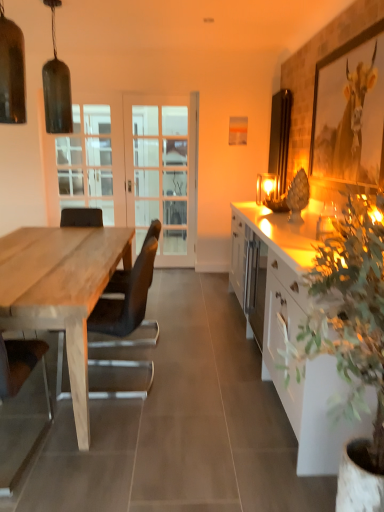
Question: From the image's perspective, is matte glass pendant light at upper left, which is the 3th lamp from right to left, positioned above or below metallic gold picture frame at upper right, positioned as the first picture frame in front-to-back order?

Choices:
 (A) above
 (B) below

Answer: (A)

Question: From a real-world perspective, is matte glass pendant light at upper left, which is the 3th lamp from right to left, above or below metallic gold picture frame at upper right, the 2th picture frame from the back?

Choices:
 (A) below
 (B) above

Answer: (B)

Question: Considering the real-world distances, which object is farthest from the metallic gold picture frame at upper right, the 2th picture frame from the back?

Choices:
 (A) matte glass lamp at upper right, which is counted as the third lamp, starting from the front
 (B) white glass screen door at center, which is the second screen door in left-to-right order
 (C) matte glass pendant light at upper left, the second lamp viewed from the front
 (D) brown leather chair at left, acting as the first chair starting from the front
 (E) black leather chair at left, marked as the 1th chair in a right-to-left arrangement

Answer: (C)

Question: Estimate the real-world distances between objects in this image. Which object is farther from the matte wooden picture frame at upper center, positioned as the 2th picture frame in right-to-left order?

Choices:
 (A) white glossy cabinet at right
 (B) natural wood table at left
 (C) clear glass door at center, which ranks as the 2th screen door in right-to-left order
 (D) matte glass pendant light at upper left, placed as the 2th lamp when sorted from back to front
 (E) black leather chair at left, the 1th chair positioned from the back

Answer: (E)